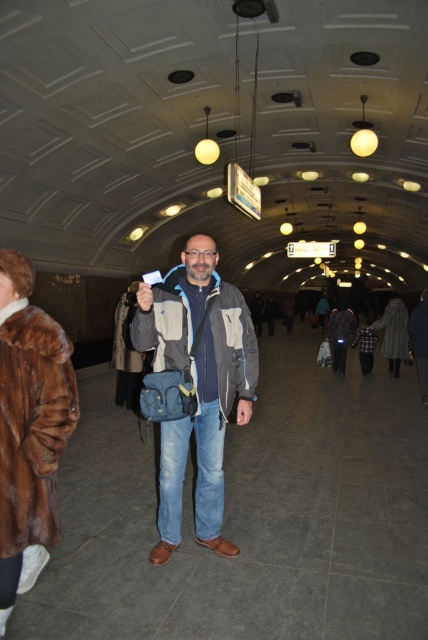
Question: Does matte gray jacket at center have a greater width compared to brown fur coat at left?

Choices:
 (A) no
 (B) yes

Answer: (B)

Question: Which point appears farthest from the camera in this image?

Choices:
 (A) (27, 401)
 (B) (178, 428)

Answer: (B)

Question: Which object appears closest to the camera in this image?

Choices:
 (A) matte gray jacket at center
 (B) brown fur coat at left

Answer: (B)

Question: Is matte gray jacket at center positioned before brown fur coat at left?

Choices:
 (A) yes
 (B) no

Answer: (B)

Question: Does matte gray jacket at center appear over brown fur coat at left?

Choices:
 (A) no
 (B) yes

Answer: (A)

Question: Which point appears farthest from the camera in this image?

Choices:
 (A) (137, 305)
 (B) (51, 401)

Answer: (A)